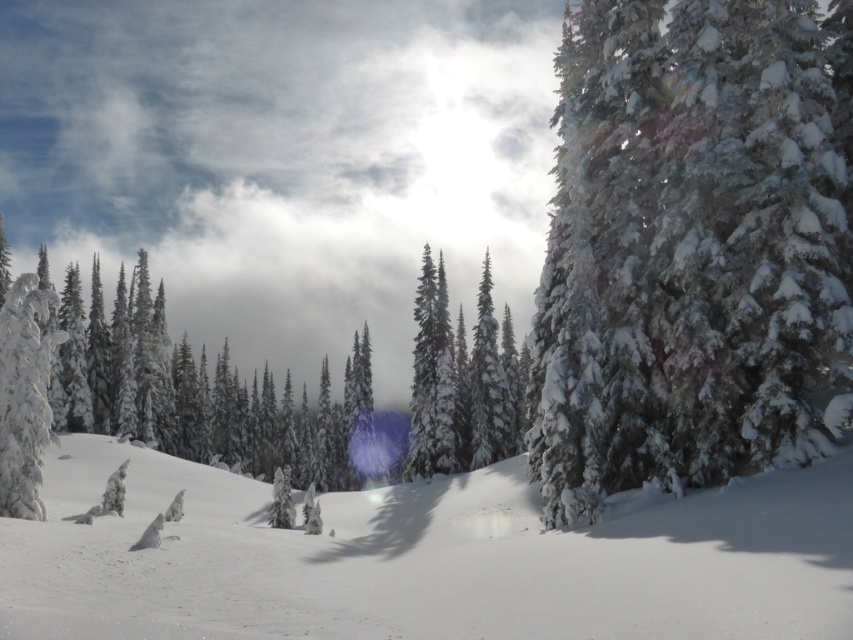
Is white snow-covered tree at left taller than snow-covered evergreen trees at center?

Yes, white snow-covered tree at left is taller than snow-covered evergreen trees at center.

Does point (97, 372) lie in front of point (483, 353)?

No, (97, 372) is behind (483, 353).

Where is `white snow-covered tree at left`? This screenshot has width=853, height=640. white snow-covered tree at left is located at coordinates (201, 392).

Which is in front, point (27, 310) or point (447, 381)?

Positioned in front is point (27, 310).

Does point (44, 396) come farther from viewer compared to point (431, 412)?

That is False.

Which is in front, point (30, 285) or point (432, 300)?

Point (30, 285)

What are the coordinates of `white frosty tree at left` in the screenshot? It's located at (25, 394).

Who is more forward, (363, 24) or (451, 456)?

Positioned in front is point (451, 456).

Can you confirm if white fluffy cloud at upper center is shorter than green matte tree at center?

In fact, white fluffy cloud at upper center may be taller than green matte tree at center.

Does point (309, 371) come in front of point (434, 376)?

That is False.

What are the coordinates of `white fluffy cloud at upper center` in the screenshot? It's located at pos(283,161).